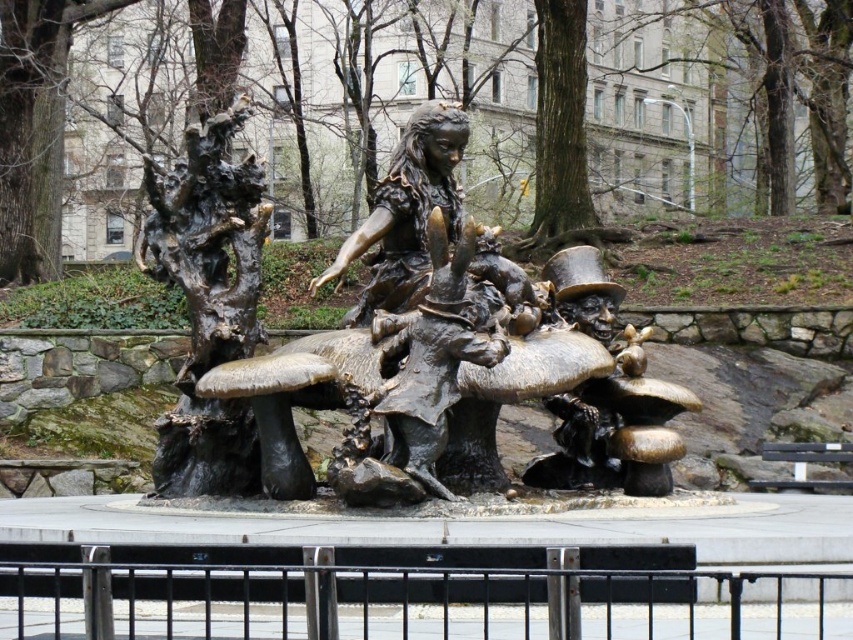
Between point (619, 209) and point (625, 440), which one is positioned in front?

Point (625, 440) is more forward.

Does point (65, 8) come farther from viewer compared to point (659, 445)?

Yes, it is.

Identify the location of bronze textured tree at center. The width and height of the screenshot is (853, 640). (550, 109).